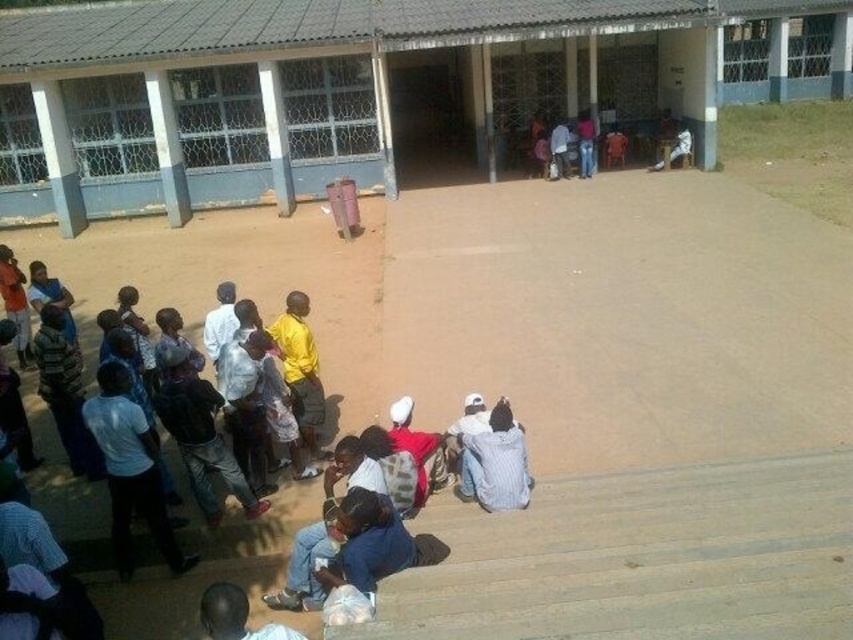
Who is lower down, gray concrete building at center or dark blue shirt at lower left?

dark blue shirt at lower left

Between gray concrete building at center and dark blue shirt at lower left, which one has less height?

dark blue shirt at lower left

The image size is (853, 640). What do you see at coordinates (364, 90) in the screenshot?
I see `gray concrete building at center` at bounding box center [364, 90].

Where is `gray concrete building at center`? Image resolution: width=853 pixels, height=640 pixels. gray concrete building at center is located at coordinates (364, 90).